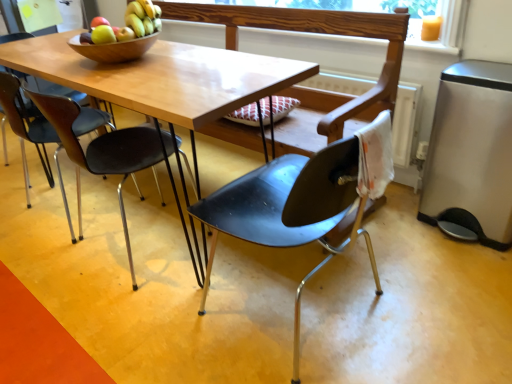
This screenshot has width=512, height=384. What are the coordinates of `vacant area that is in front of matte black chair at left, the 1th chair when ordered from left to right` in the screenshot? It's located at click(x=50, y=263).